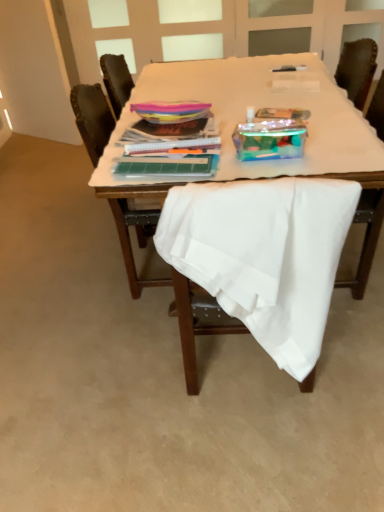
Question: Should I look upward or downward to see white fabric-covered table at center?

Choices:
 (A) up
 (B) down

Answer: (A)

Question: Is white fabric-covered table at center behind white fabric chair at center, marked as the 2th chair in a back-to-front arrangement?

Choices:
 (A) yes
 (B) no

Answer: (A)

Question: Could you tell me if white fabric-covered table at center is facing white fabric chair at center, marked as the 2th chair in a back-to-front arrangement?

Choices:
 (A) no
 (B) yes

Answer: (A)

Question: Is white fabric chair at center, marked as the 2th chair in a back-to-front arrangement, a part of white fabric-covered table at center?

Choices:
 (A) yes
 (B) no

Answer: (B)

Question: From the image's perspective, would you say white fabric-covered table at center is shown under white fabric chair at center, marked as the 2th chair in a back-to-front arrangement?

Choices:
 (A) no
 (B) yes

Answer: (A)

Question: Does white fabric-covered table at center have a larger size compared to white fabric chair at center, marked as the 2th chair in a back-to-front arrangement?

Choices:
 (A) yes
 (B) no

Answer: (A)

Question: Is white fabric-covered table at center to the left of white fabric chair at center, marked as the 2th chair in a back-to-front arrangement, from the viewer's perspective?

Choices:
 (A) yes
 (B) no

Answer: (B)

Question: From the image's perspective, is white fabric chair at center, marked as the 2th chair in a back-to-front arrangement, beneath wooden chair at center, acting as the second chair starting from the front?

Choices:
 (A) no
 (B) yes

Answer: (B)

Question: Is white fabric chair at center, the 1th chair viewed from the front, at the left side of wooden chair at center, placed as the 1th chair when sorted from back to front?

Choices:
 (A) yes
 (B) no

Answer: (B)

Question: Is white fabric chair at center, the 1th chair viewed from the front, located outside wooden chair at center, acting as the second chair starting from the front?

Choices:
 (A) no
 (B) yes

Answer: (B)

Question: From a real-world perspective, is white fabric chair at center, marked as the 2th chair in a back-to-front arrangement, below wooden chair at center, placed as the 1th chair when sorted from back to front?

Choices:
 (A) yes
 (B) no

Answer: (B)

Question: Is white fabric chair at center, the 1th chair viewed from the front, placed right next to wooden chair at center, placed as the 1th chair when sorted from back to front?

Choices:
 (A) no
 (B) yes

Answer: (A)

Question: Does white fabric chair at center, the 1th chair viewed from the front, turn towards wooden chair at center, placed as the 1th chair when sorted from back to front?

Choices:
 (A) no
 (B) yes

Answer: (B)

Question: Can you confirm if white fabric-covered table at center is wider than wooden chair at center, acting as the second chair starting from the front?

Choices:
 (A) yes
 (B) no

Answer: (A)